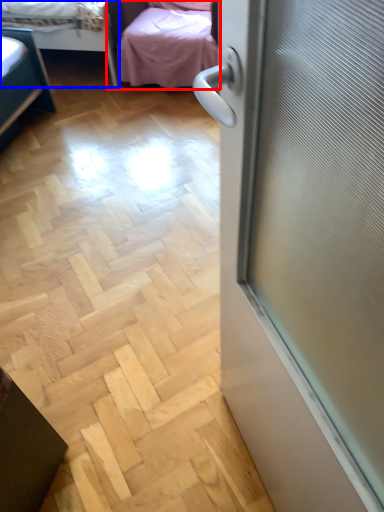
Question: Among these objects, which one is farthest to the camera, studio couch (highlighted by a red box) or bed (highlighted by a blue box)?

Choices:
 (A) studio couch
 (B) bed

Answer: (B)